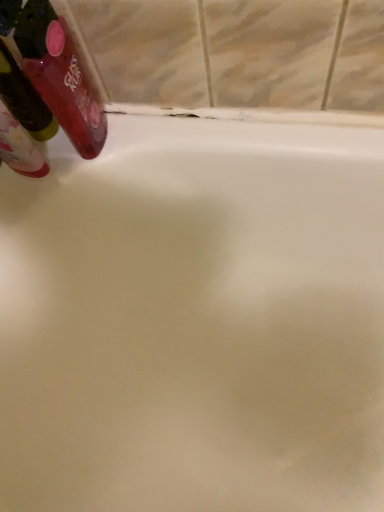
Question: Considering their positions, is translucent plastic mouthwash at upper left, the second mouthwash viewed from the right, located in front of or behind translucent plastic mouthwash at upper left, arranged as the first mouthwash when viewed from the right?

Choices:
 (A) front
 (B) behind

Answer: (B)

Question: From the image's perspective, is translucent plastic mouthwash at upper left, the second mouthwash viewed from the right, above or below translucent plastic mouthwash at upper left, arranged as the first mouthwash when viewed from the right?

Choices:
 (A) below
 (B) above

Answer: (A)

Question: Is translucent plastic mouthwash at upper left, the second mouthwash viewed from the right, to the left or to the right of translucent plastic mouthwash at upper left, acting as the second mouthwash starting from the left, in the image?

Choices:
 (A) left
 (B) right

Answer: (A)

Question: Is translucent plastic mouthwash at upper left, acting as the second mouthwash starting from the left, wider or thinner than translucent plastic mouthwash at upper left, the 1th mouthwash when ordered from left to right?

Choices:
 (A) thin
 (B) wide

Answer: (B)

Question: From a real-world perspective, relative to translucent plastic mouthwash at upper left, the second mouthwash viewed from the right, is translucent plastic mouthwash at upper left, arranged as the first mouthwash when viewed from the right, vertically above or below?

Choices:
 (A) above
 (B) below

Answer: (A)

Question: Considering the positions of translucent plastic mouthwash at upper left, arranged as the first mouthwash when viewed from the right, and translucent plastic mouthwash at upper left, the second mouthwash viewed from the right, in the image, is translucent plastic mouthwash at upper left, arranged as the first mouthwash when viewed from the right, bigger or smaller than translucent plastic mouthwash at upper left, the second mouthwash viewed from the right,?

Choices:
 (A) small
 (B) big

Answer: (B)

Question: Is point (79, 103) closer or farther from the camera than point (33, 163)?

Choices:
 (A) closer
 (B) farther

Answer: (A)